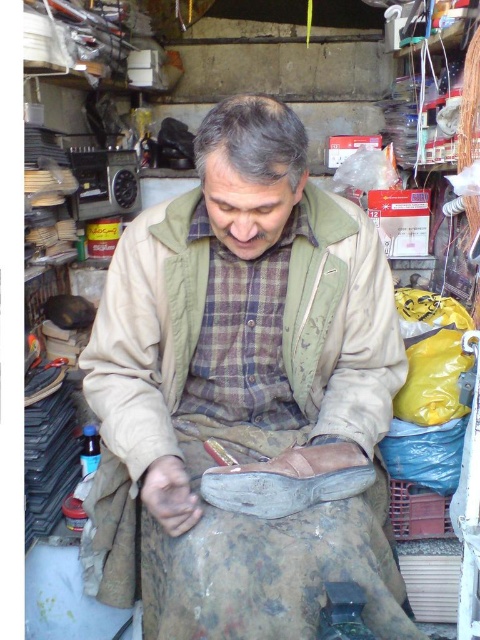
Question: Can you confirm if beige fabric jacket at center is positioned above brown leather shoe at lower center?

Choices:
 (A) yes
 (B) no

Answer: (A)

Question: Is beige fabric jacket at center thinner than brown leather shoe at lower center?

Choices:
 (A) no
 (B) yes

Answer: (A)

Question: Does beige fabric jacket at center appear on the left side of brown leather shoe at lower center?

Choices:
 (A) no
 (B) yes

Answer: (B)

Question: Which point is closer to the camera taking this photo?

Choices:
 (A) (86, 381)
 (B) (371, 465)

Answer: (B)

Question: Which of the following is the farthest from the observer?

Choices:
 (A) (275, 500)
 (B) (170, 278)

Answer: (B)

Question: Which point appears closest to the camera in this image?

Choices:
 (A) (379, 321)
 (B) (229, 465)

Answer: (B)